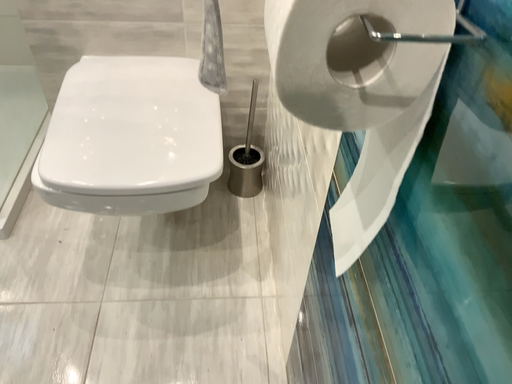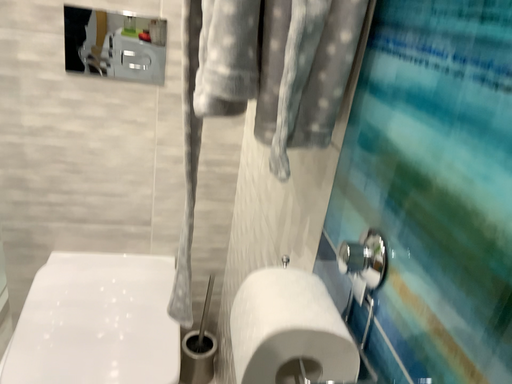
Question: Which way did the camera rotate in the video?

Choices:
 (A) rotated right
 (B) rotated left

Answer: (A)